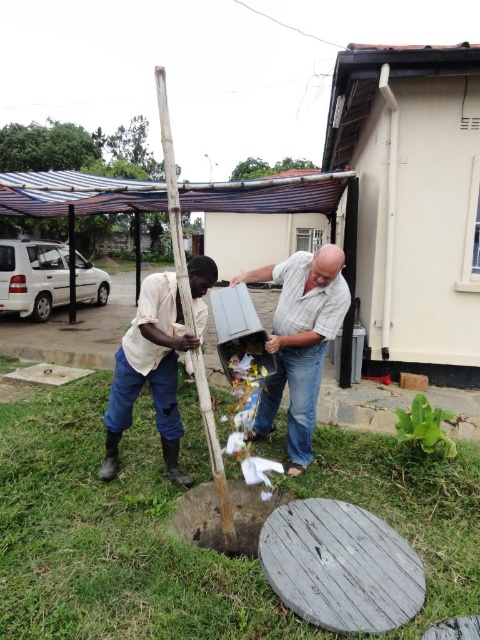
Consider the image. You are planning to install a new awning that matches the width of the blue striped canopy at upper left. If the green leafy tree at upper center is currently blocking part of where you want to place it, will the tree interfere with the awning installation?

The blue striped canopy at upper left is wider than the green leafy tree at upper center, so the tree might not fully block the installation area. However, since the tree is at upper center and the canopy is at upper left, their positions might overlap, causing potential interference. Check the exact placement for overlap.

What is located at the coordinates point (224,516) in the image?

The point (224,516) corresponds to dark brown wood at center.

Based on the photo, you are standing at the center of the image. Which direction should you look to see the blue striped canopy at upper left?

You should look to the upper left direction to see the blue striped canopy at upper left.